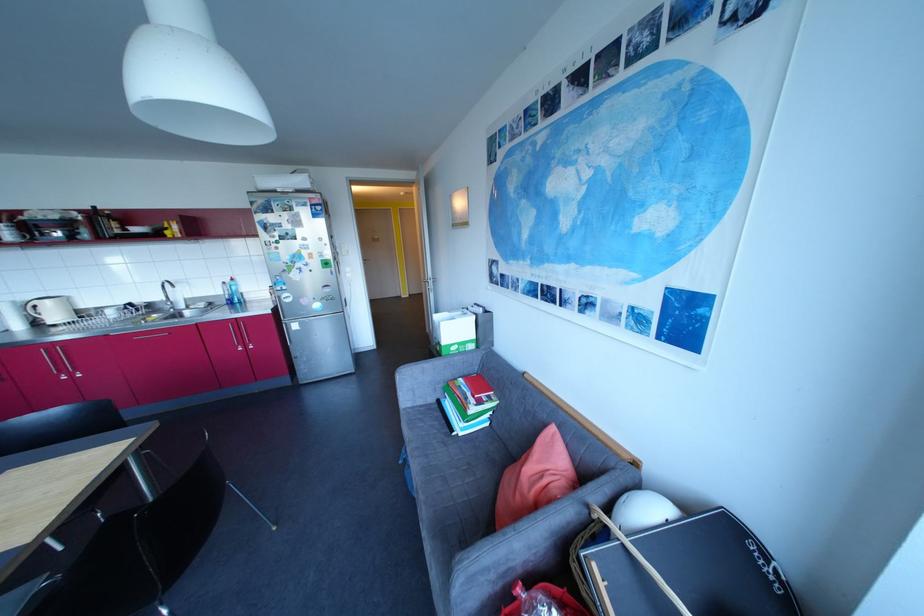
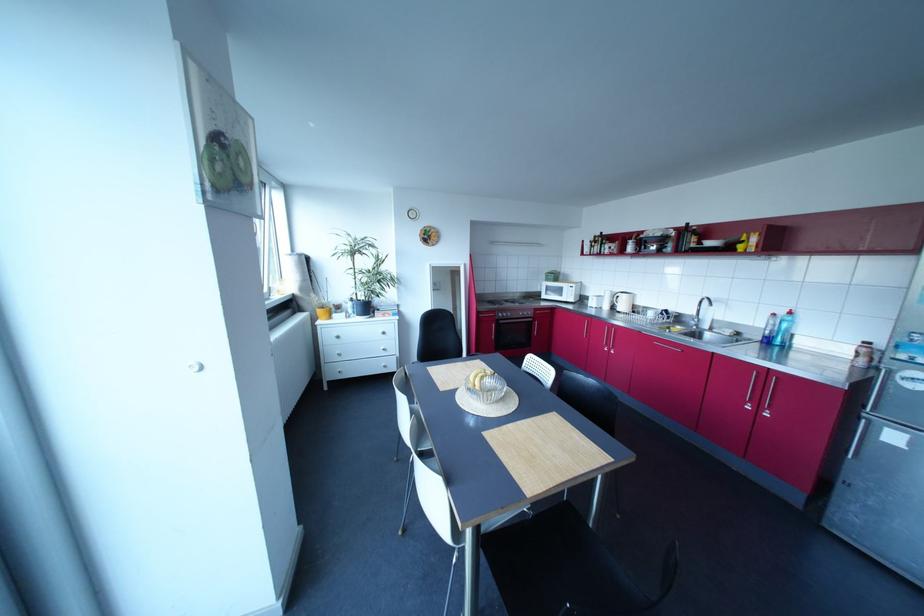
Question: Based on the continuous images, in which direction is the camera rotating? Reply with the corresponding letter.

Choices:
 (A) Left
 (B) Right
 (C) Up
 (D) Down

Answer: (A)